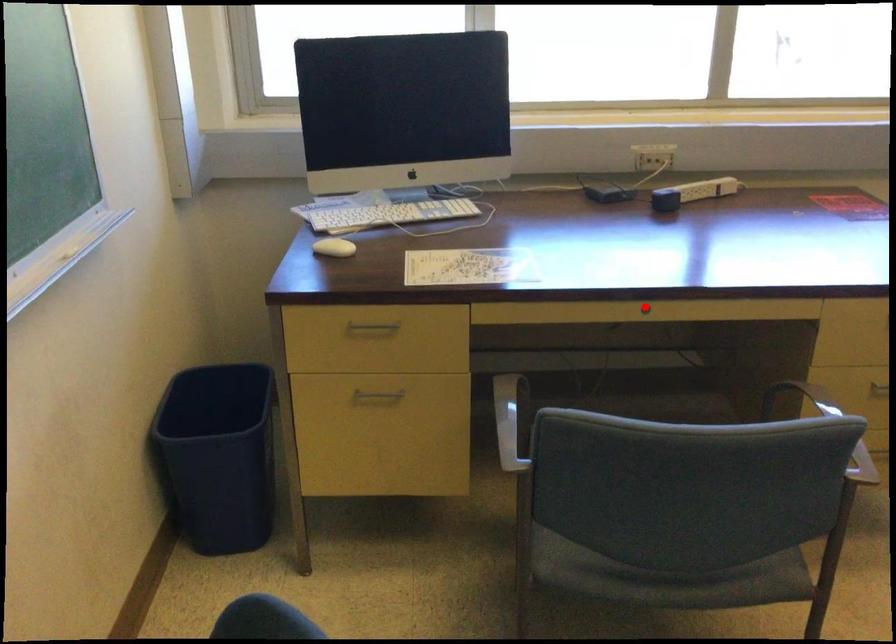
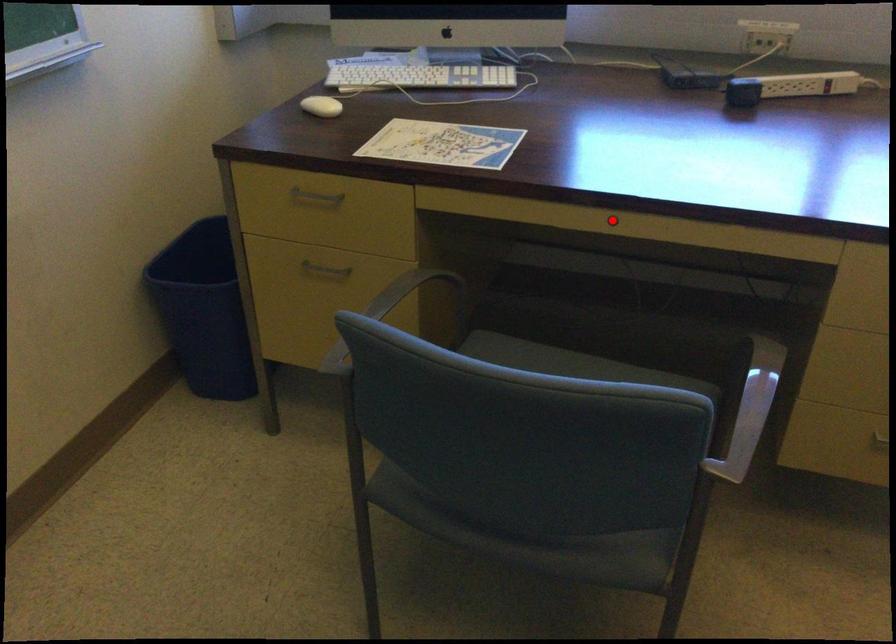
I am providing you with two images of the same scene from different viewpoints. A red point is marked on the first image and another point is marked on the second image. Is the red point in image1 aligned with the point shown in image2?

Yes